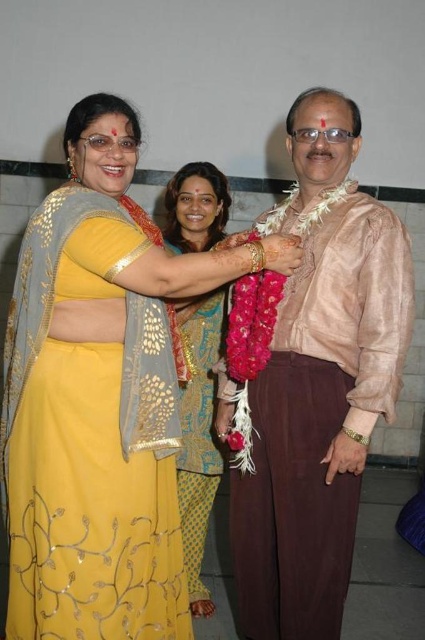
Consider the image. You are a photographer at the event and want to capture both the yellow satin saree at center and the pink silk shirt at center in the same frame. Which one should you focus on first to ensure they are both in the frame?

The yellow satin saree at center is positioned on the left side of the pink silk shirt at center, so you should focus on the pink silk shirt at center first to ensure both are in the frame.

In the scene shown: You are a photographer positioned in front of the group. You notice the pink silk shirt at center and the golden sequined saree at center. Which one appears larger in your camera view?

The pink silk shirt at center appears larger because it is closer to the viewer than the golden sequined saree at center.